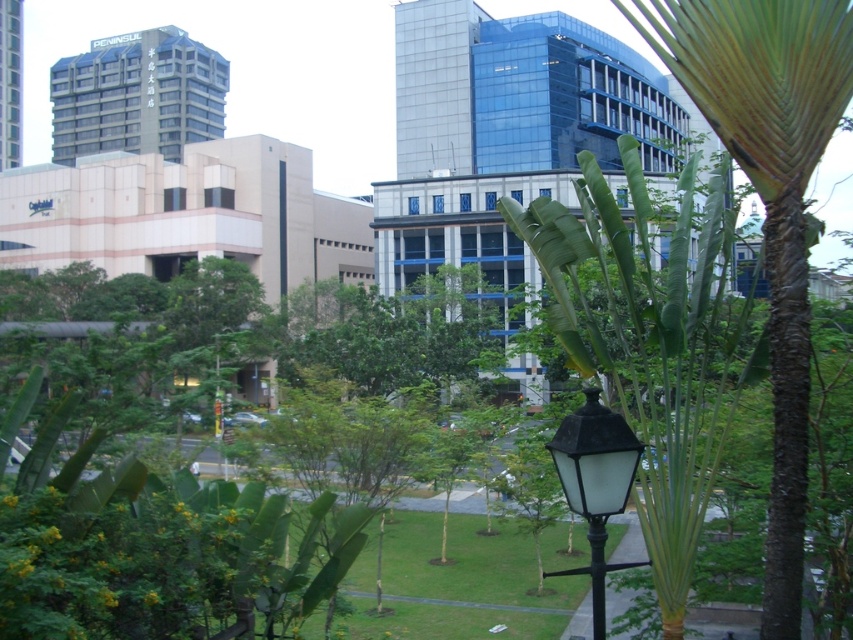
Between green leafy palm at center and black glass street light at center, which one has less height?

black glass street light at center is shorter.

Who is higher up, green leafy palm at center or black glass street light at center?

green leafy palm at center is above.

Does point (763, 93) come farther from viewer compared to point (558, 458)?

No, it is in front of (558, 458).

In order to click on green leafy palm at center in this screenshot , I will do `click(769, 200)`.

Does green leafy palm tree at center have a smaller size compared to green leafy palm at center?

No, green leafy palm tree at center is not smaller than green leafy palm at center.

Who is more forward, [563,285] or [822,106]?

Point [822,106] is more forward.

Locate an element on the screen. The image size is (853, 640). green leafy palm tree at center is located at coordinates [x=653, y=339].

Does green leafy palm tree at center have a larger size compared to black glass street light at center?

Indeed, green leafy palm tree at center has a larger size compared to black glass street light at center.

Is green leafy palm tree at center to the right of black glass street light at center from the viewer's perspective?

Yes, green leafy palm tree at center is to the right of black glass street light at center.

Measure the distance between green leafy palm tree at center and camera.

green leafy palm tree at center is 18.74 feet from camera.

The width and height of the screenshot is (853, 640). I want to click on green leafy palm tree at center, so click(x=653, y=339).